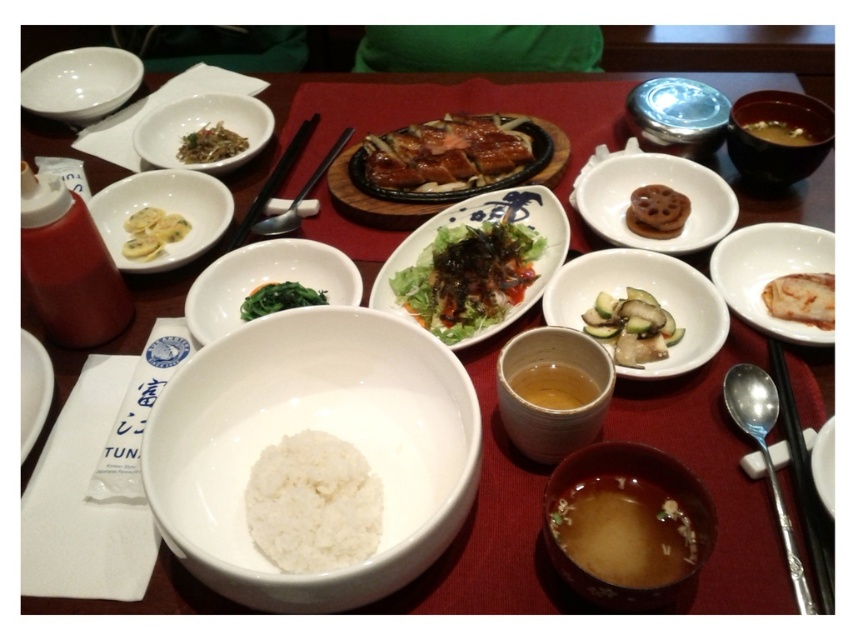
You are a diner sitting at the table and want to use the black metal chopsticks at lower right to eat the green leafy vegetable at center. Is the chopsticks position making it easy to reach the vegetable?

The black metal chopsticks at lower right is located below green leafy vegetable at center, so the chopsticks are positioned below the vegetable, which may make it slightly inconvenient to reach, but still accessible with a slight adjustment of hand position.

You are a diner sitting at the table. You want to reach for the white matte dumplings at center left and the brown ceramic bowl at upper right. Which item will you grab first if you want to take the one closer to you?

The white matte dumplings at center left is closer to the viewer than the brown ceramic bowl at upper right, so you should grab the white matte dumplings at center left first.